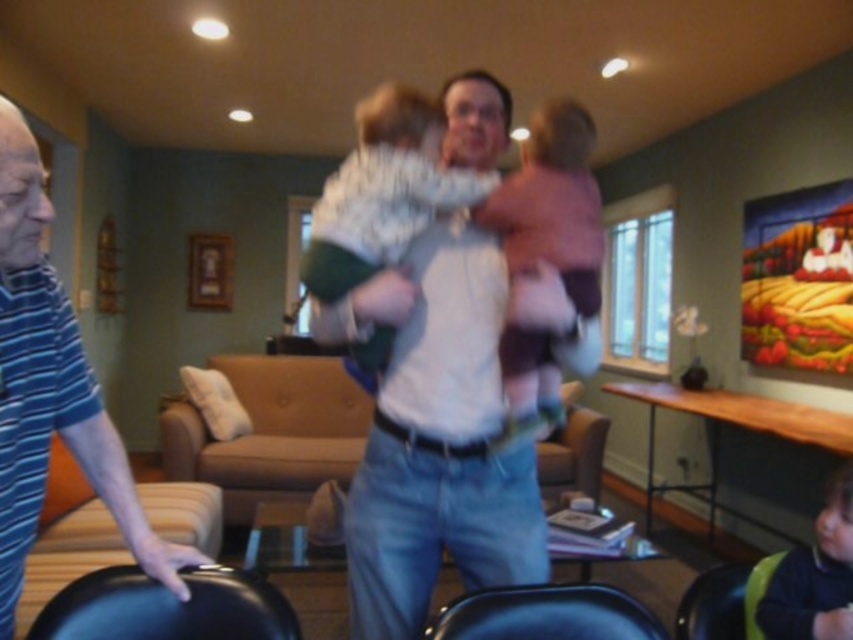
Question: Is pink soft fabric baby at center below dark green sweater at lower right?

Choices:
 (A) yes
 (B) no

Answer: (B)

Question: Is white cotton shirt at center smaller than blue striped shirt at left?

Choices:
 (A) yes
 (B) no

Answer: (B)

Question: Which object is closer to the camera taking this photo?

Choices:
 (A) black leather chair at lower left
 (B) pink soft fabric baby at center

Answer: (A)

Question: Estimate the real-world distances between objects in this image. Which object is farther from the white cotton shirt at center?

Choices:
 (A) blue striped shirt at left
 (B) black leather chair at lower center

Answer: (A)

Question: Does white cotton shirt at center appear under black leather chair at lower left?

Choices:
 (A) no
 (B) yes

Answer: (A)

Question: Which of these objects is positioned closest to the blue striped shirt at left?

Choices:
 (A) white cotton shirt at center
 (B) white knit sweater at center

Answer: (B)